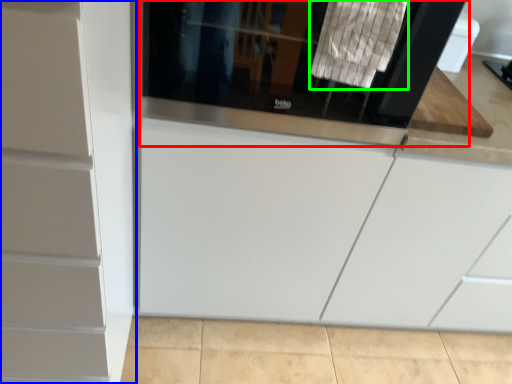
Question: Based on their relative distances, which object is farther from screen door (highlighted by a red box)? Choose from cabinetry (highlighted by a blue box) and laundry (highlighted by a green box).

Choices:
 (A) cabinetry
 (B) laundry

Answer: (A)